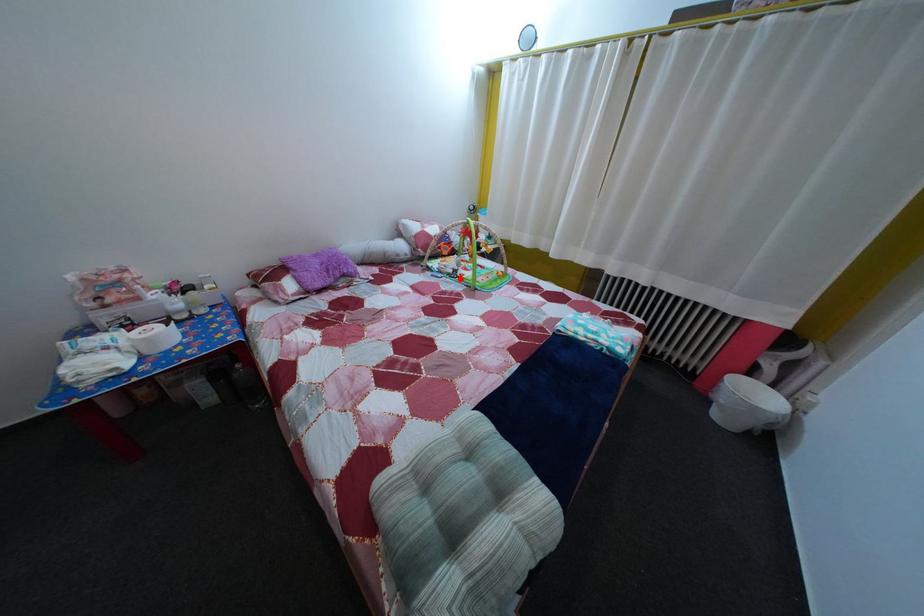
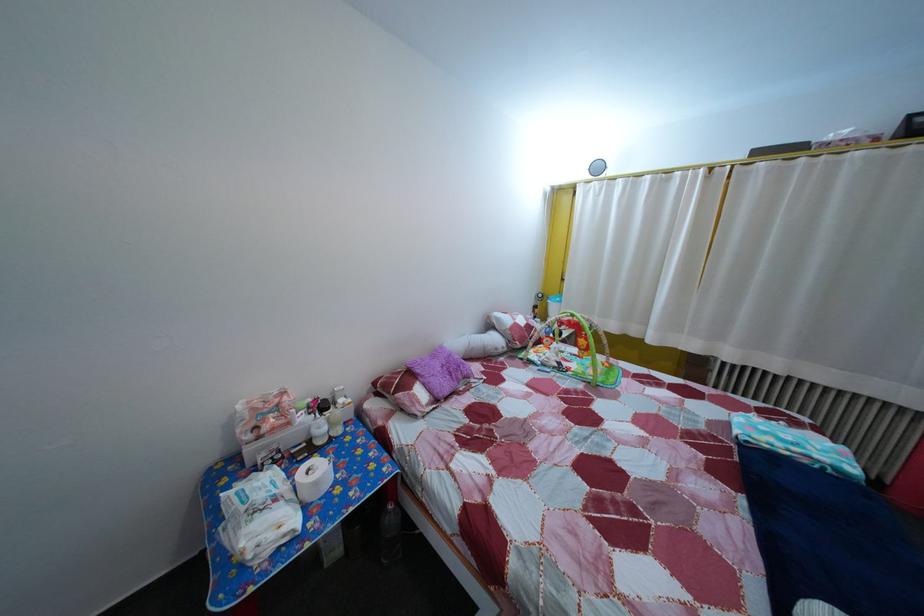
Find the pixel in the second image that matches the highlighted location in the first image.

(565, 371)